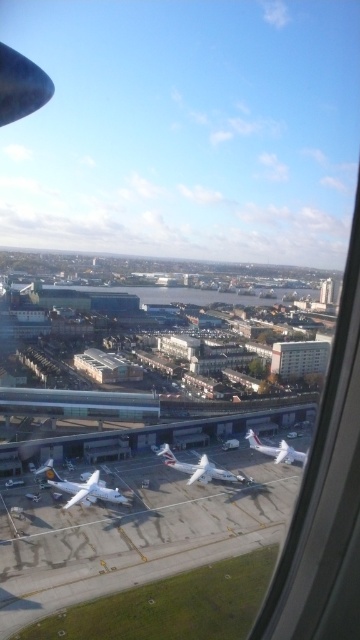
You are a pilot who needs to board passengers. The white glossy airplane at center is your aircraft. You see a boarding ramp that is 120 meters long. Can you determine if the boarding ramp can reach your aircraft?

The distance between the boarding ramp and the white glossy airplane at center is 123.81 meters, so the boarding ramp cannot reach the white glossy airplane at center since it is longer than the ramp length.